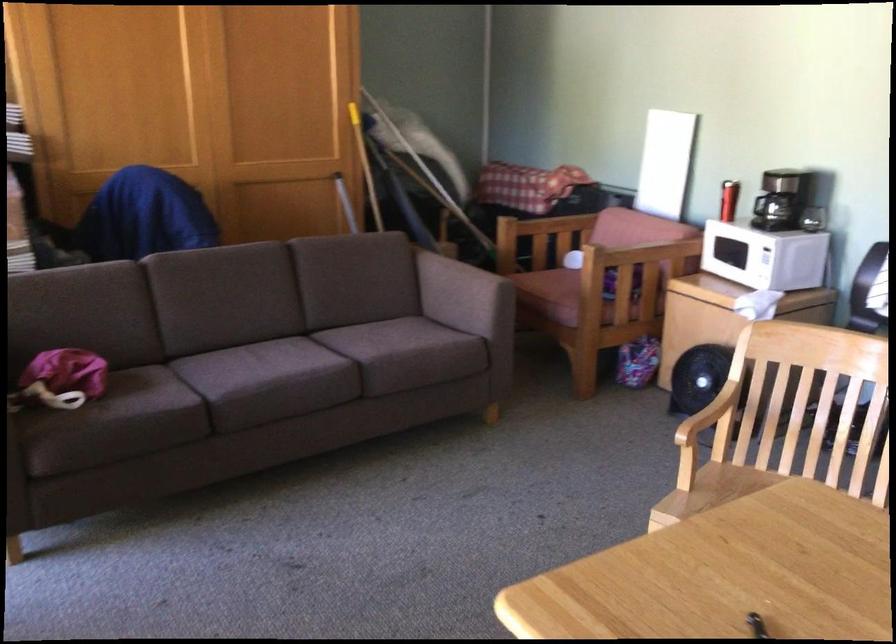
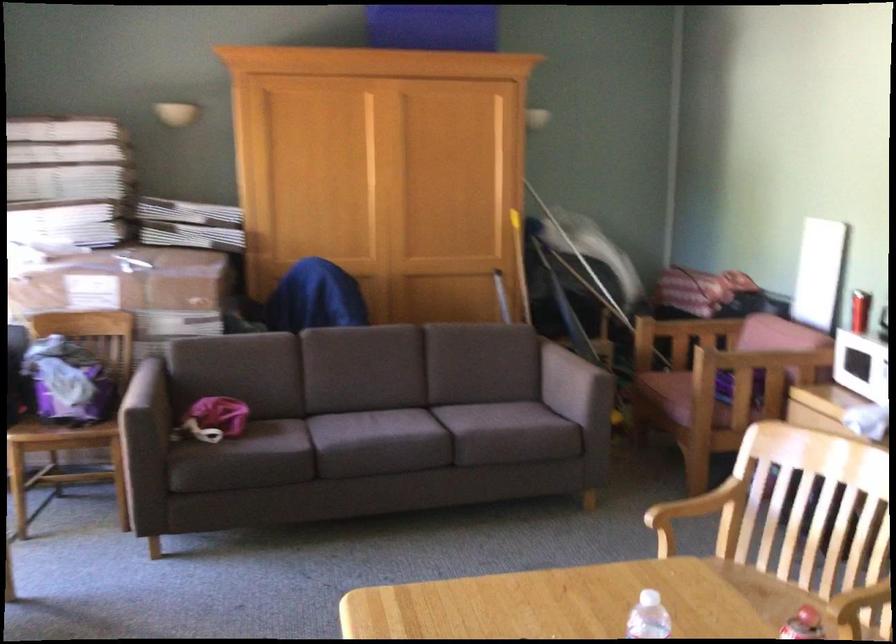
Locate, in the second image, the point that corresponds to point 687,419 in the first image.

(694, 512)